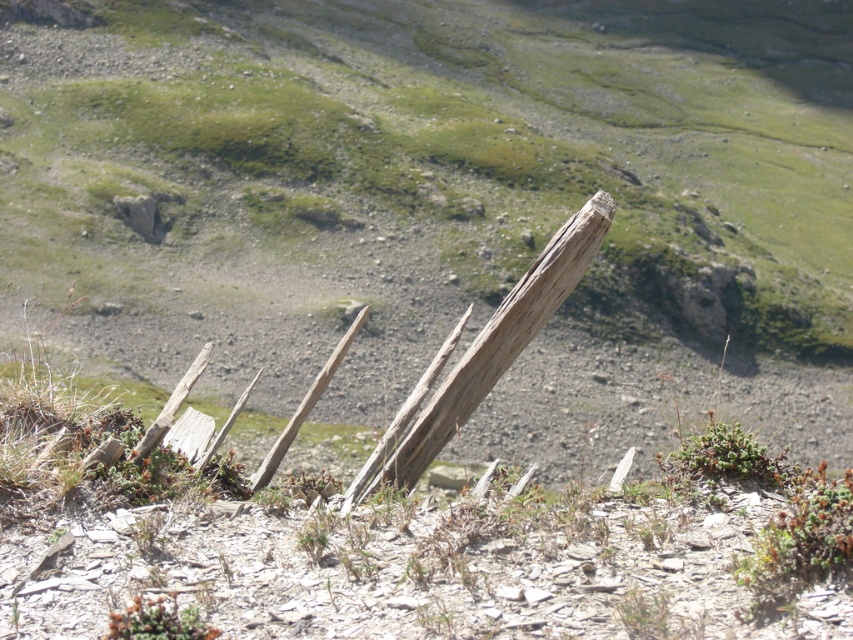
Question: Is green leafy plant at lower right positioned at the back of green leafy plant at lower left?

Choices:
 (A) yes
 (B) no

Answer: (A)

Question: Which object is farther from the camera taking this photo?

Choices:
 (A) green leafy plant at lower right
 (B) green leafy plant at lower left

Answer: (A)

Question: Where is green leafy plant at lower right located in relation to green leafy plant at lower left in the image?

Choices:
 (A) left
 (B) right

Answer: (B)

Question: Which point is farther to the camera?

Choices:
 (A) (195, 636)
 (B) (780, 484)

Answer: (B)

Question: Is green leafy plant at lower right below green leafy plant at lower left?

Choices:
 (A) no
 (B) yes

Answer: (A)